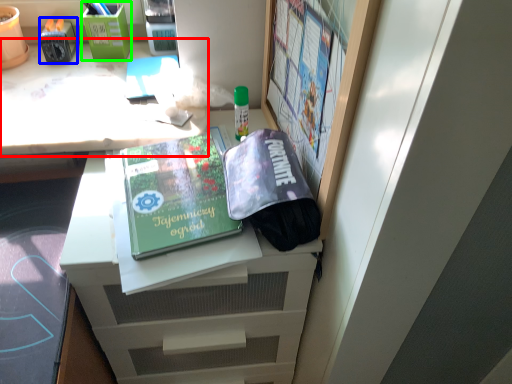
Question: Which object is positioned farthest from desk (highlighted by a red box)? Select from stationery (highlighted by a blue box) and stationery (highlighted by a green box).

Choices:
 (A) stationery
 (B) stationery

Answer: (A)